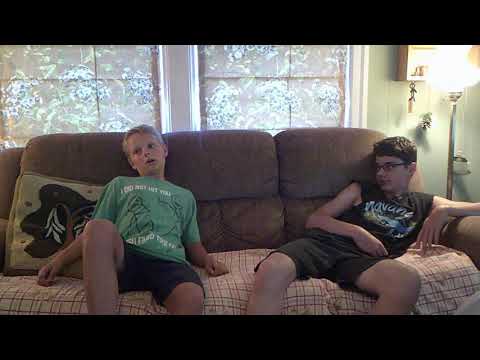
What are the coordinates of `throw pillow` in the screenshot? It's located at (24, 223).